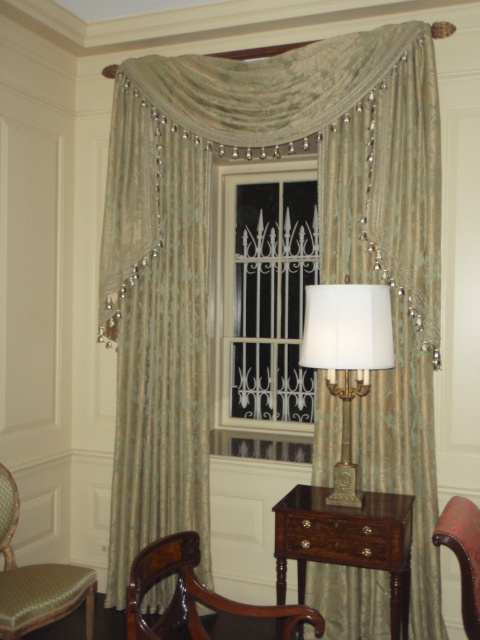
You are a furniture arranger who wants to place a new sofa that is 40 inches wide in the room. The sofa must be placed between the white fabric lampshade at center and the mahogany wood armchair at lower left. Is there enough space for the sofa?

The distance between the white fabric lampshade at center and the mahogany wood armchair at lower left is 37.35 inches. Since the sofa is 40 inches wide, it would not fit in the available space.

You are standing in the room and want to sit down. Where is the mahogany wood armchair at lower left located in the room?

The mahogany wood armchair at lower left is located at point (193,595) in the room.